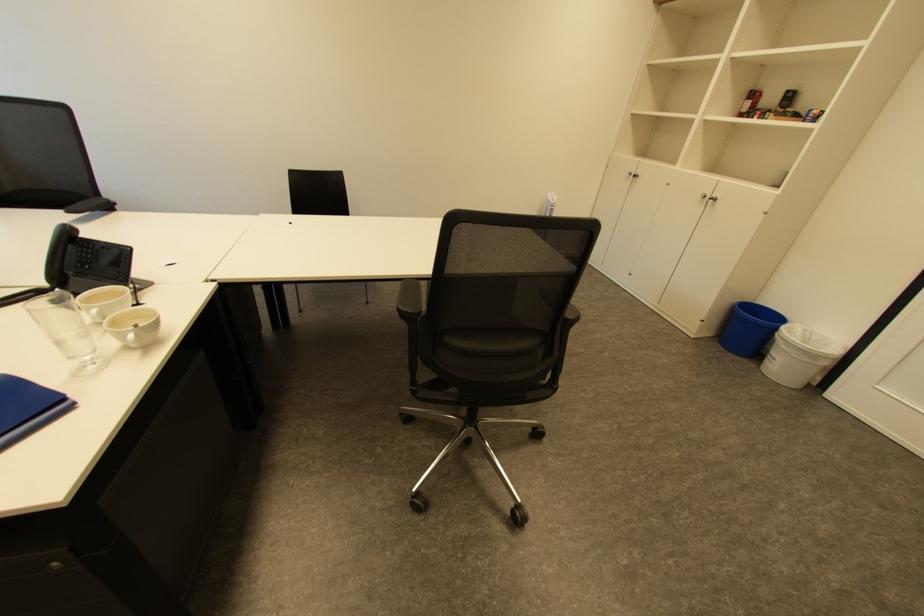
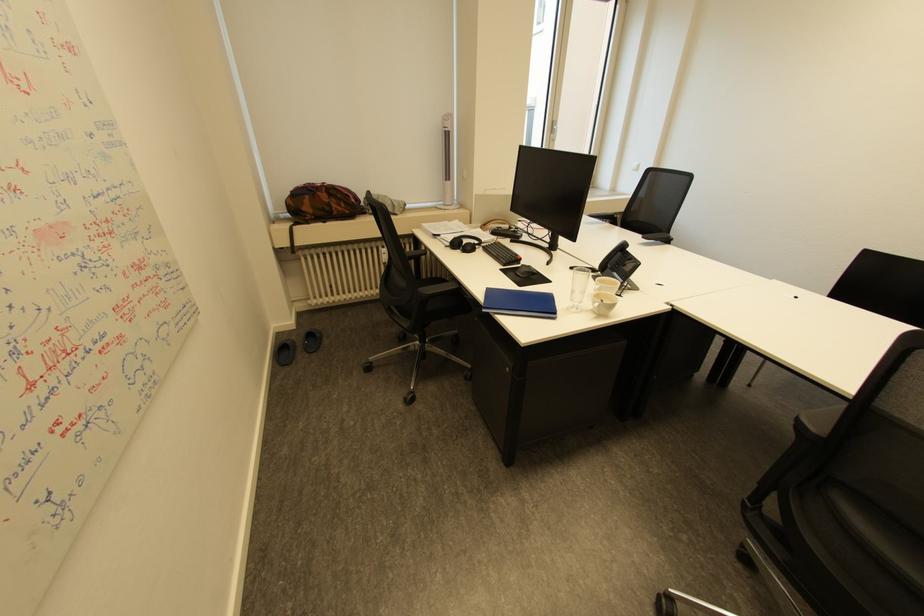
Find the pixel in the second image that matches point 76,274 in the first image.

(616, 267)